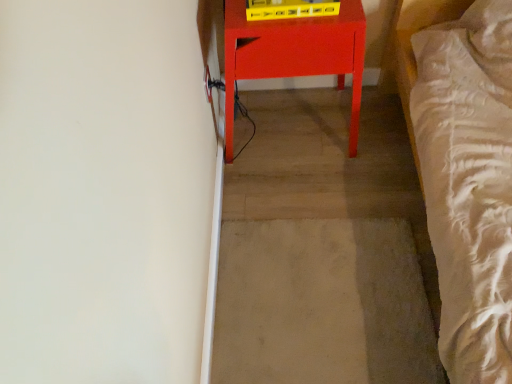
Question: Considering the positions of beige carpet at center and matte red table at center in the image, is beige carpet at center taller or shorter than matte red table at center?

Choices:
 (A) short
 (B) tall

Answer: (A)

Question: Considering the positions of beige carpet at center and matte red table at center in the image, is beige carpet at center wider or thinner than matte red table at center?

Choices:
 (A) thin
 (B) wide

Answer: (B)

Question: Is beige carpet at center bigger or smaller than matte red table at center?

Choices:
 (A) small
 (B) big

Answer: (A)

Question: From the image's perspective, is matte red table at center located above or below beige carpet at center?

Choices:
 (A) above
 (B) below

Answer: (A)

Question: Relative to beige carpet at center, is matte red table at center in front or behind?

Choices:
 (A) front
 (B) behind

Answer: (A)

Question: Is matte red table at center inside the boundaries of beige carpet at center, or outside?

Choices:
 (A) outside
 (B) inside

Answer: (A)

Question: Does point (355, 89) appear closer or farther from the camera than point (380, 274)?

Choices:
 (A) farther
 (B) closer

Answer: (B)